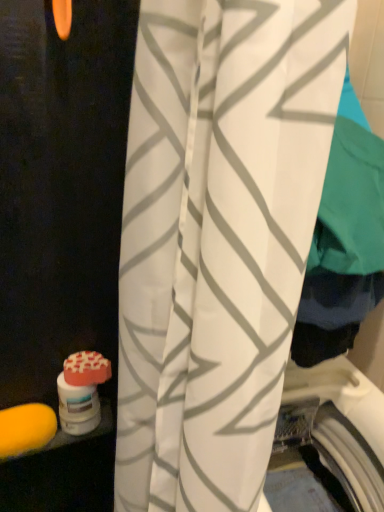
Question: Based on their positions, is orange matte soap at lower left, which is the second soap in left-to-right order, located to the left or right of yellow sponge at lower left, placed as the first soap when sorted from bottom to top?

Choices:
 (A) right
 (B) left

Answer: (A)

Question: Is point (81, 372) closer or farther from the camera than point (52, 417)?

Choices:
 (A) closer
 (B) farther

Answer: (A)

Question: Which object is the farthest from the orange matte soap at lower left, which is the second soap in left-to-right order?

Choices:
 (A) yellow sponge at lower left, placed as the first soap when sorted from bottom to top
 (B) white fabric curtain at center

Answer: (B)

Question: Estimate the real-world distances between objects in this image. Which object is closer to the yellow sponge at lower left, the 1th soap in the left-to-right sequence?

Choices:
 (A) white fabric curtain at center
 (B) orange matte soap at lower left, arranged as the first soap when viewed from the right

Answer: (B)